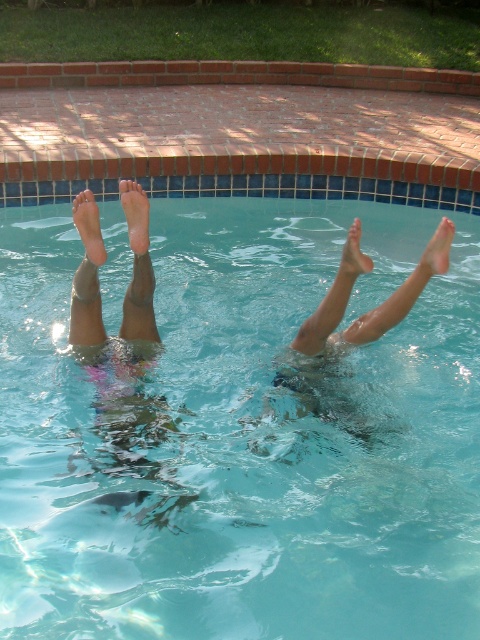
Question: Which point appears farthest from the camera in this image?

Choices:
 (A) (363, 262)
 (B) (90, 244)

Answer: (B)

Question: Is skinny legs at center behind matte skin foot at center?

Choices:
 (A) yes
 (B) no

Answer: (B)

Question: Can you confirm if pale skin foot at lower center is positioned to the right of pink matte foot at upper center?

Choices:
 (A) yes
 (B) no

Answer: (B)

Question: Which point is closer to the camera?

Choices:
 (A) matte skin foot at upper right
 (B) matte skin foot at center

Answer: (B)

Question: Is skinny legs at center to the left of pale skin foot at lower center from the viewer's perspective?

Choices:
 (A) yes
 (B) no

Answer: (A)

Question: Among these objects, which one is farthest from the camera?

Choices:
 (A) skinny legs at center
 (B) pale skin foot at lower center
 (C) clear glass water at center
 (D) pink matte foot at upper center

Answer: (D)